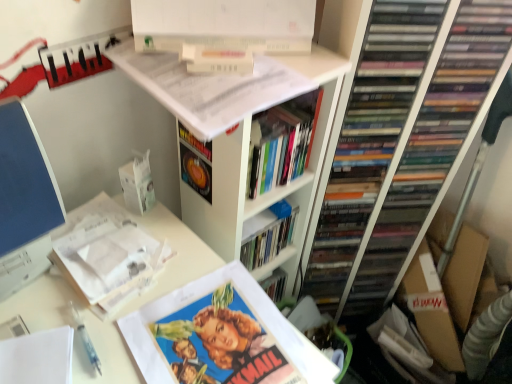
Question: Considering the relative sizes of white matte bookshelf at upper center and hardcover book at center, positioned as the second book in top-to-bottom order, in the image provided, is white matte bookshelf at upper center thinner than hardcover book at center, positioned as the second book in top-to-bottom order,?

Choices:
 (A) no
 (B) yes

Answer: (A)

Question: Is white matte bookshelf at upper center to the right of hardcover book at center, positioned as the second book in top-to-bottom order, from the viewer's perspective?

Choices:
 (A) yes
 (B) no

Answer: (B)

Question: Considering the relative positions of white matte bookshelf at upper center and hardcover book at center, placed as the third book when sorted from bottom to top, in the image provided, is white matte bookshelf at upper center to the left of hardcover book at center, placed as the third book when sorted from bottom to top, from the viewer's perspective?

Choices:
 (A) yes
 (B) no

Answer: (A)

Question: Is white matte bookshelf at upper center completely or partially outside of hardcover book at center, placed as the third book when sorted from bottom to top?

Choices:
 (A) yes
 (B) no

Answer: (A)

Question: Is white matte bookshelf at upper center shorter than hardcover book at center, placed as the third book when sorted from bottom to top?

Choices:
 (A) no
 (B) yes

Answer: (A)

Question: In terms of width, does white matte bookshelf at upper center look wider or thinner when compared to hardcover book at center, positioned as the second book in top-to-bottom order?

Choices:
 (A) thin
 (B) wide

Answer: (B)

Question: From their relative heights in the image, would you say white matte bookshelf at upper center is taller or shorter than hardcover book at center, positioned as the second book in top-to-bottom order?

Choices:
 (A) short
 (B) tall

Answer: (B)

Question: In terms of size, does white matte bookshelf at upper center appear bigger or smaller than hardcover book at center, placed as the third book when sorted from bottom to top?

Choices:
 (A) big
 (B) small

Answer: (A)

Question: Is point (196, 79) closer or farther from the camera than point (253, 134)?

Choices:
 (A) closer
 (B) farther

Answer: (A)

Question: Considering the positions of white matte bookshelf at upper center and white paper at upper left, positioned as the 2th book in bottom-to-top order, in the image, is white matte bookshelf at upper center wider or thinner than white paper at upper left, positioned as the 2th book in bottom-to-top order,?

Choices:
 (A) thin
 (B) wide

Answer: (B)

Question: Is white matte bookshelf at upper center inside or outside of white paper at upper left, which appears as the third book when viewed from the top?

Choices:
 (A) inside
 (B) outside

Answer: (B)

Question: In the image, is white matte bookshelf at upper center positioned in front of or behind white paper at upper left, positioned as the 2th book in bottom-to-top order?

Choices:
 (A) front
 (B) behind

Answer: (A)

Question: Is white matte bookshelf at upper center taller or shorter than white paper at upper left, which appears as the third book when viewed from the top?

Choices:
 (A) tall
 (B) short

Answer: (A)

Question: Looking at the image, does hardcover book at center, placed as the third book when sorted from bottom to top, seem bigger or smaller compared to white matte book at upper center, positioned as the fourth book in bottom-to-top order?

Choices:
 (A) small
 (B) big

Answer: (B)

Question: Considering the positions of hardcover book at center, positioned as the second book in top-to-bottom order, and white matte book at upper center, positioned as the fourth book in bottom-to-top order, in the image, is hardcover book at center, positioned as the second book in top-to-bottom order, taller or shorter than white matte book at upper center, positioned as the fourth book in bottom-to-top order,?

Choices:
 (A) short
 (B) tall

Answer: (B)